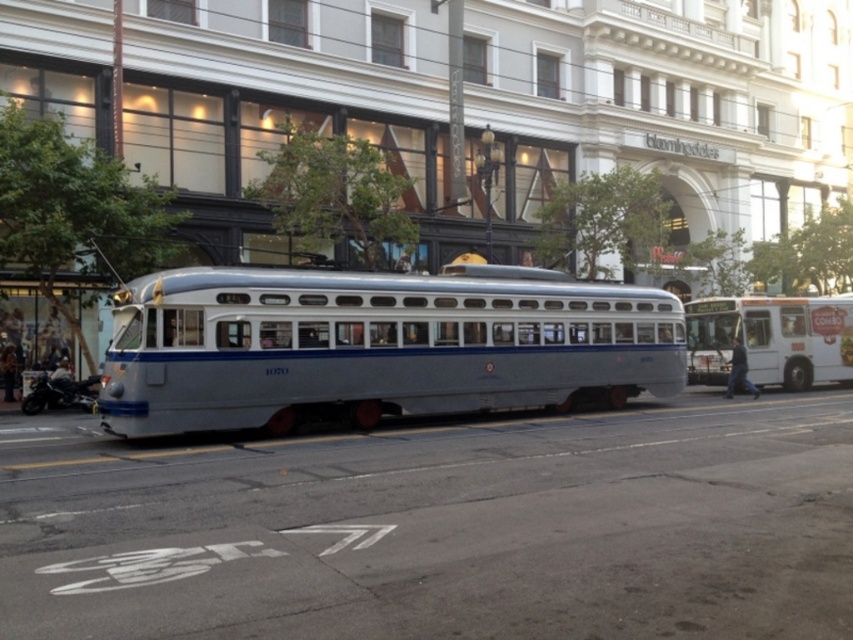
You are standing at the position of the vintage trolley car numbered 1070. You see two points marked on the street scene, point (161, 304) and point (699, 356). Which point is closer to you?

Point (161, 304) is closer to the viewer than point (699, 356).

You are a pedestrian standing on the sidewalk and want to cross the street to reach the white matte bus at right. The silver polished tram at center is blocking your path. Can you walk around it to get to the bus?

The silver polished tram at center is in front of the white matte bus at right, so you can walk around the tram to reach the bus since it is blocking the direct path but not the entire area.

You are a delivery person who needs to load a package onto a vehicle. The package requires clearance of at least 2 meters in height. Looking at the silver polished tram at center and the white matte bus at right, which vehicle can accommodate the package?

The silver polished tram at center is taller than the white matte bus at right, so the package requiring 2 meters in height can be accommodated by the silver polished tram at center if its height meets or exceeds 2 meters. However, without specific height measurements, we can only confirm that the tram is taller than the bus. Assuming the tram meets the height requirement, it would be the suitable choice.